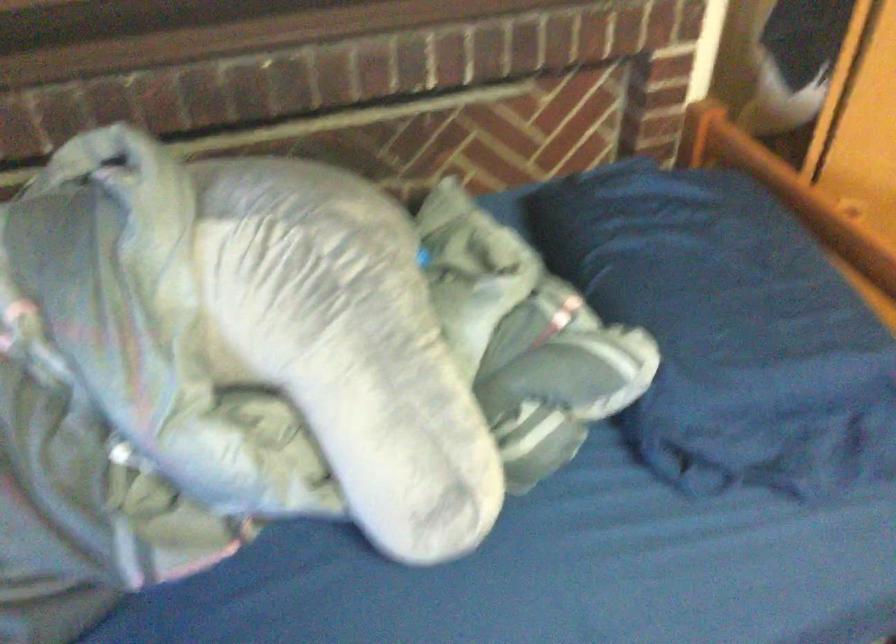
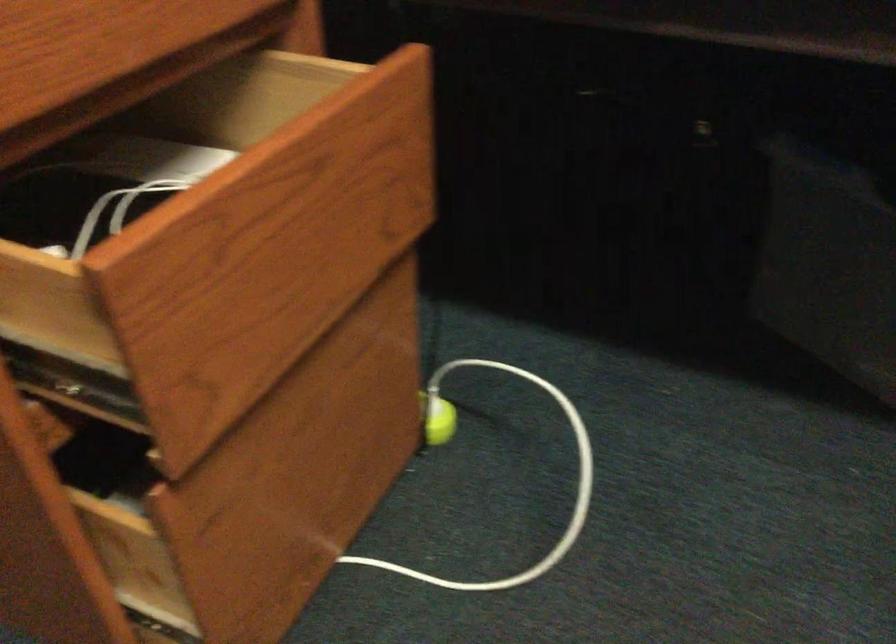
Question: The first image is from the beginning of the video and the second image is from the end. How did the camera likely rotate when shooting the video?

Choices:
 (A) Left
 (B) Right
 (C) Up
 (D) Down

Answer: (A)